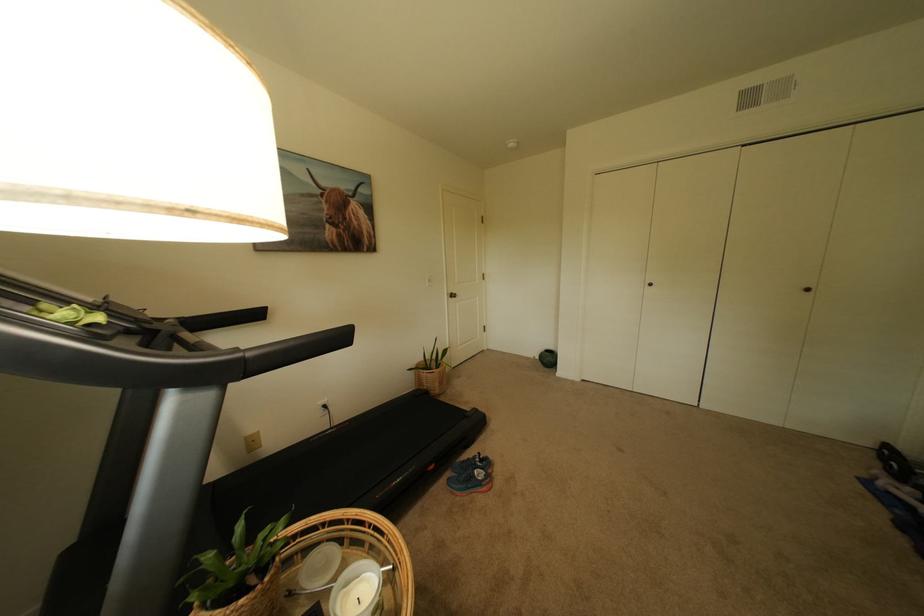
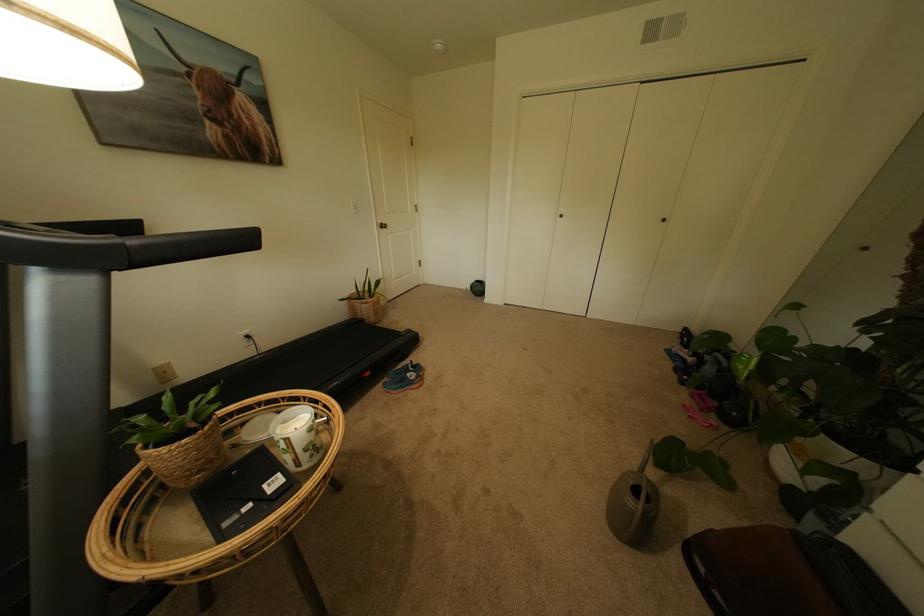
Question: I am providing you with two images of the same scene from different viewpoints. Which of the following objects are not visible in image2?

Choices:
 (A) blue running shoes
 (B) wicker plant pot
 (C) white mug handle
 (D) none of these

Answer: (D)